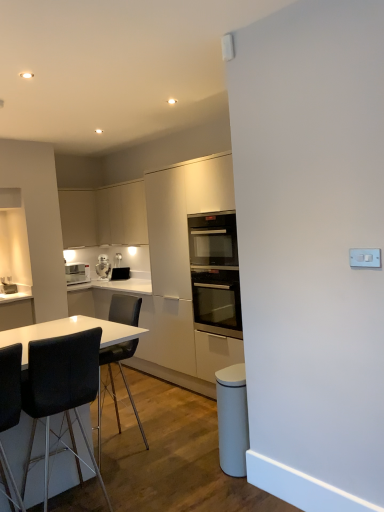
In order to click on vacant area that lies to the right of black fabric chair at lower left, which appears as the 1th chair when viewed from the back in this screenshot , I will do `click(183, 442)`.